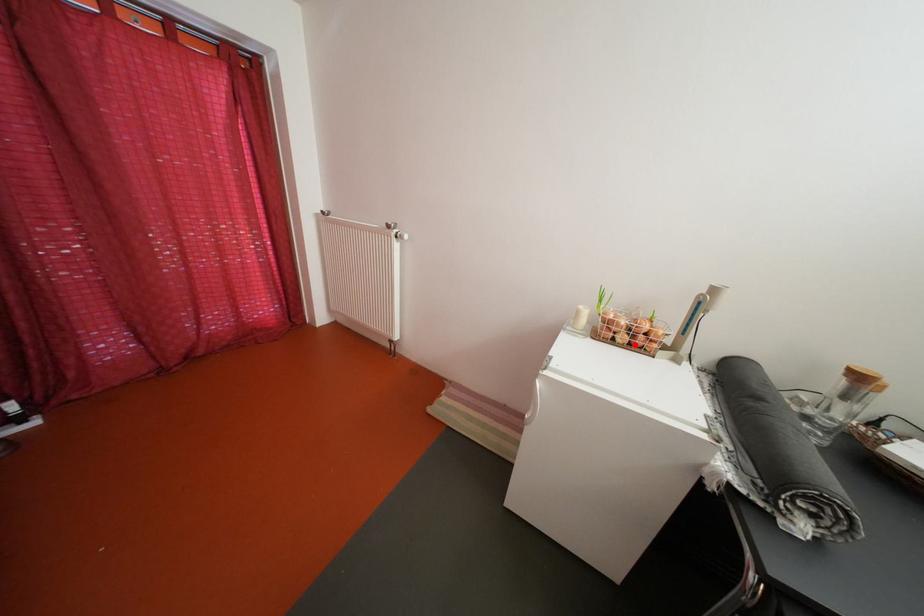
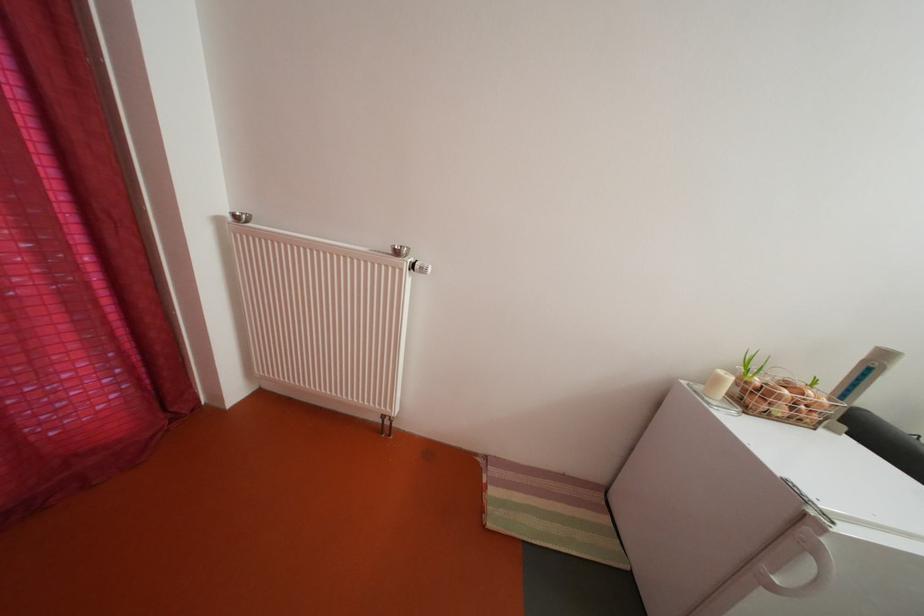
Find the pixel in the second image that matches the highlighted location in the first image.

(792, 416)